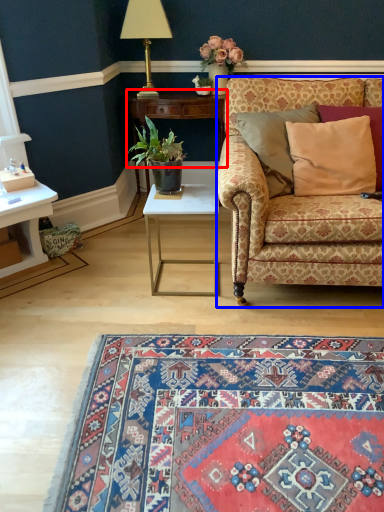
Question: Which object appears farthest to the camera in this image, table (highlighted by a red box) or studio couch (highlighted by a blue box)?

Choices:
 (A) table
 (B) studio couch

Answer: (A)